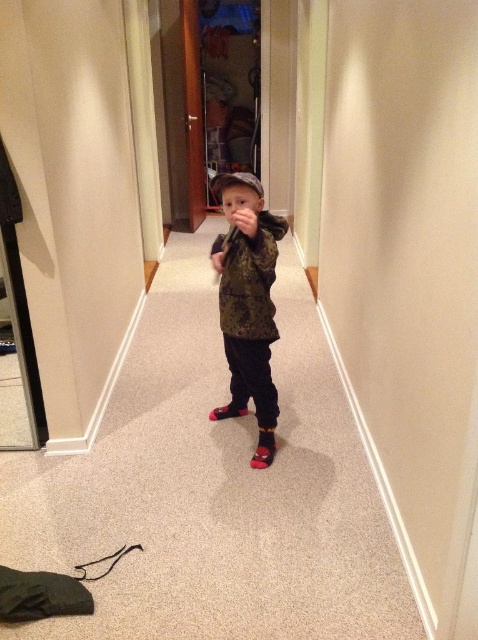
Question: Is camouflage jacket at center bigger than red suede shoe at center?

Choices:
 (A) yes
 (B) no

Answer: (A)

Question: Does camouflage jacket at center appear on the right side of red suede shoe at center?

Choices:
 (A) no
 (B) yes

Answer: (A)

Question: Can you confirm if camouflage jacket at center is bigger than red fabric shoe at center?

Choices:
 (A) no
 (B) yes

Answer: (B)

Question: Which of the following is the farthest from the observer?

Choices:
 (A) (210, 416)
 (B) (274, 445)

Answer: (A)

Question: Which is nearer to the red suede shoe at center?

Choices:
 (A) camouflage jacket at center
 (B) red fabric shoe at center

Answer: (B)

Question: Which point appears farthest from the camera in this image?

Choices:
 (A) (214, 412)
 (B) (216, 188)

Answer: (A)